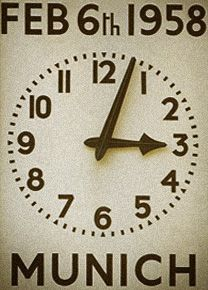
The height and width of the screenshot is (290, 208). I want to click on clock hour hand, so click(91, 143), click(146, 139), click(147, 149), click(160, 143).